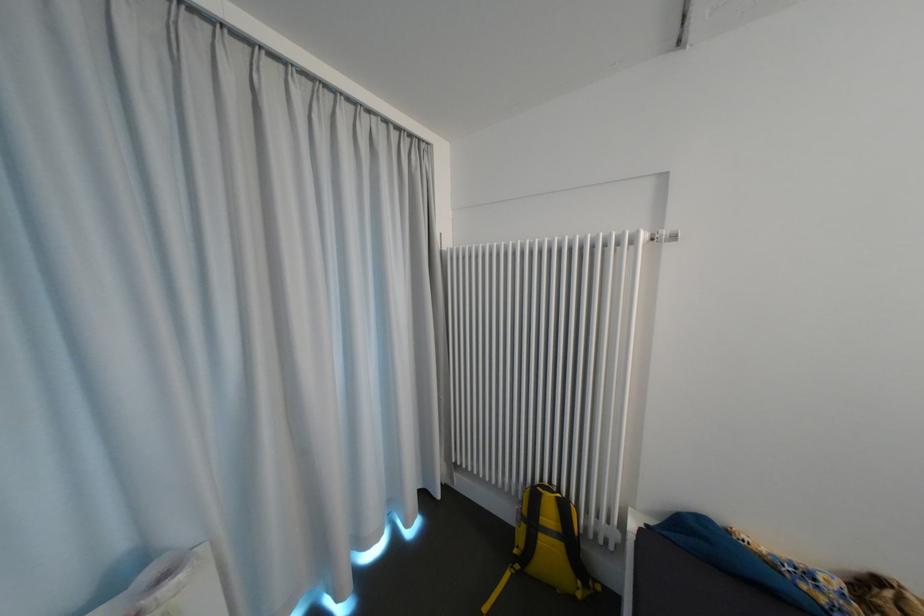
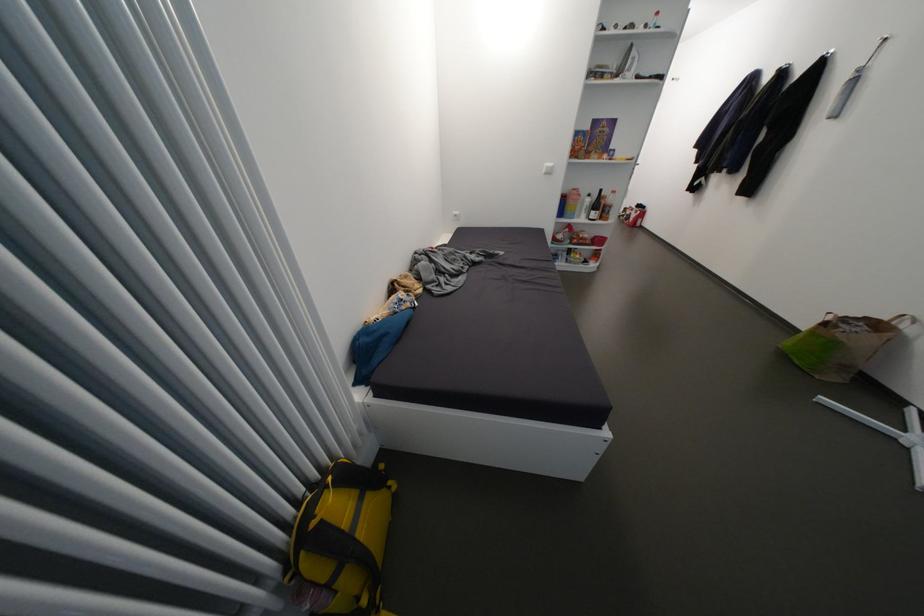
Based on the continuous images, in which direction is the camera rotating?

The camera's rotation is toward right-down.